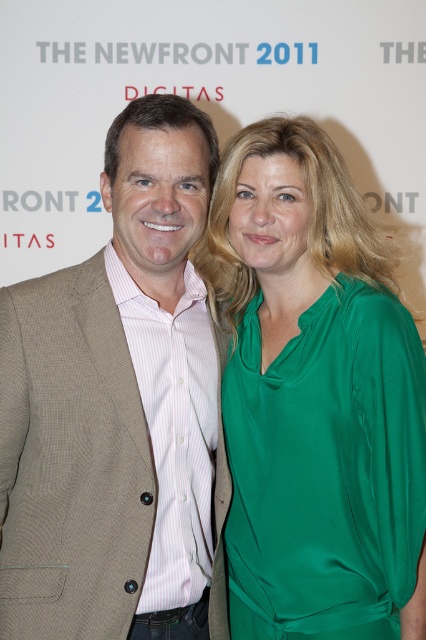
You are a photographer adjusting the camera settings to focus on the green satin blouse at center. Based on the scene description, where should you position the focus point to ensure the blouse is in sharp focus?

The green satin blouse at center is located at point (314, 397), so you should position the focus point at those coordinates to ensure the blouse is in sharp focus.

You are a fashion designer observing the two outfits in the image. Which of the two items, the green satin blouse at center or the brown textured blazer at left, is shorter in height?

The green satin blouse at center is not as tall as the brown textured blazer at left, so the green satin blouse at center is shorter in height.

Based on the scene description, can you determine the spatial relationship between the green satin blouse at center and the brown textured blazer at left?

The green satin blouse at center is positioned to the right of the brown textured blazer at left.